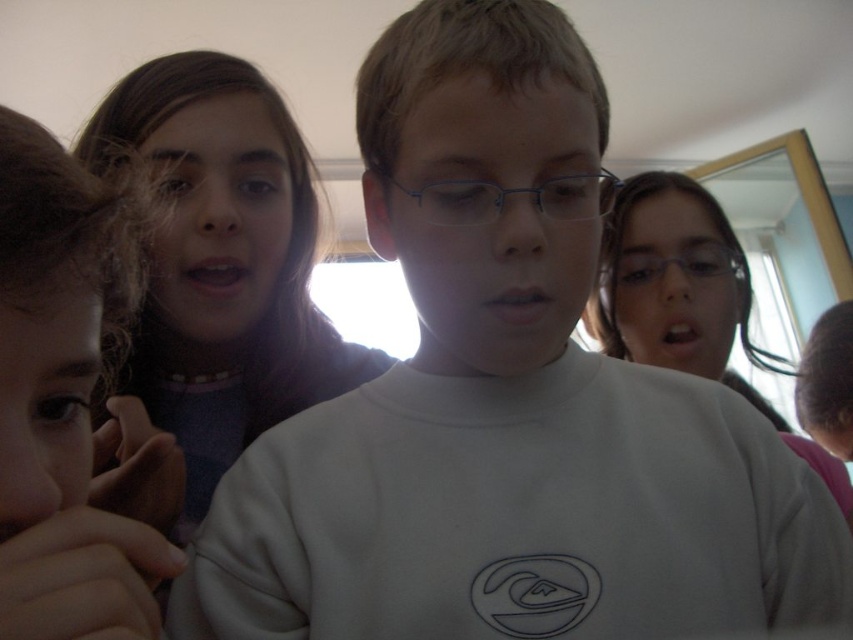
Who is lower down, matte white shirt at center or clear plastic glasses at center?

matte white shirt at center is below.

Does matte white shirt at center have a smaller size compared to clear plastic glasses at center?

No.

You are a GUI agent. You are given a task and a screenshot of the screen. Output one action in this format:
    pyautogui.click(x=<x>, y=<y>)
    Task: Click on the matte white shirt at center
    Image resolution: width=853 pixels, height=640 pixels.
    Given the screenshot: What is the action you would take?
    coord(215,280)

Where is `matte white shirt at center`? This screenshot has width=853, height=640. matte white shirt at center is located at coordinates (215, 280).

Based on the photo, which is more to the left, matte white shirt at center or metallic blue glasses at center?

matte white shirt at center is more to the left.

Does point (163, 160) come farther from viewer compared to point (479, 193)?

That is True.

Locate an element on the screen. This screenshot has height=640, width=853. matte white shirt at center is located at coordinates [x=215, y=280].

Does smooth brown hair at left have a lesser width compared to clear plastic glasses at center?

Yes.

Which of these two, smooth brown hair at left or clear plastic glasses at center, stands taller?

Standing taller between the two is smooth brown hair at left.

Identify the location of smooth brown hair at left. This screenshot has width=853, height=640. (59, 406).